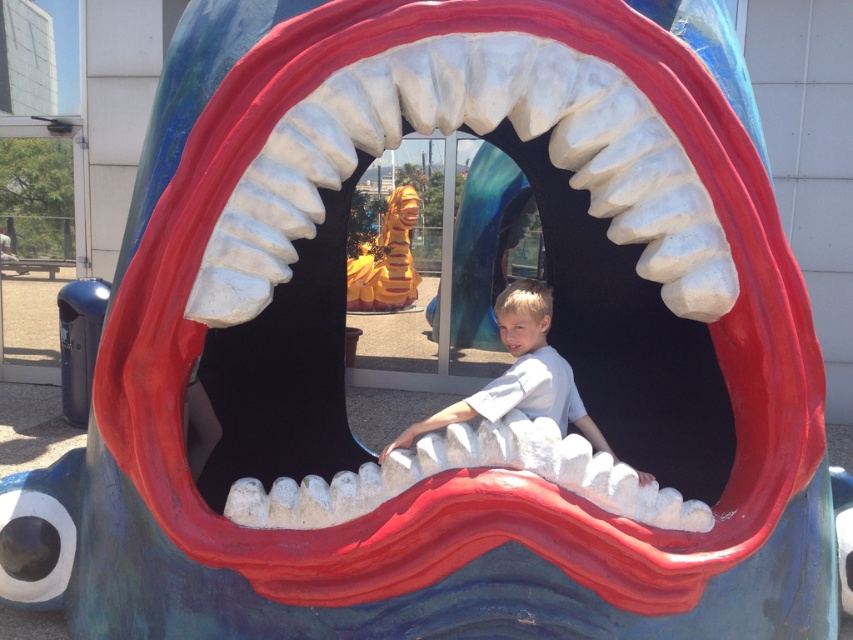
Question: Is light blue cotton shirt at center wider than white matte teeth at center?

Choices:
 (A) yes
 (B) no

Answer: (A)

Question: Can you confirm if light blue cotton shirt at center is thinner than white matte teeth at center?

Choices:
 (A) no
 (B) yes

Answer: (A)

Question: Which point is farther from the camera taking this photo?

Choices:
 (A) (508, 342)
 (B) (416, 275)
 (C) (541, 358)

Answer: (B)

Question: Which point is farther from the camera taking this photo?

Choices:
 (A) (512, 349)
 (B) (368, 269)

Answer: (B)

Question: Which point appears closest to the camera in this image?

Choices:
 (A) (399, 301)
 (B) (503, 337)

Answer: (B)

Question: Does light blue cotton shirt at center have a lesser width compared to gold metallic dragon at center?

Choices:
 (A) no
 (B) yes

Answer: (A)